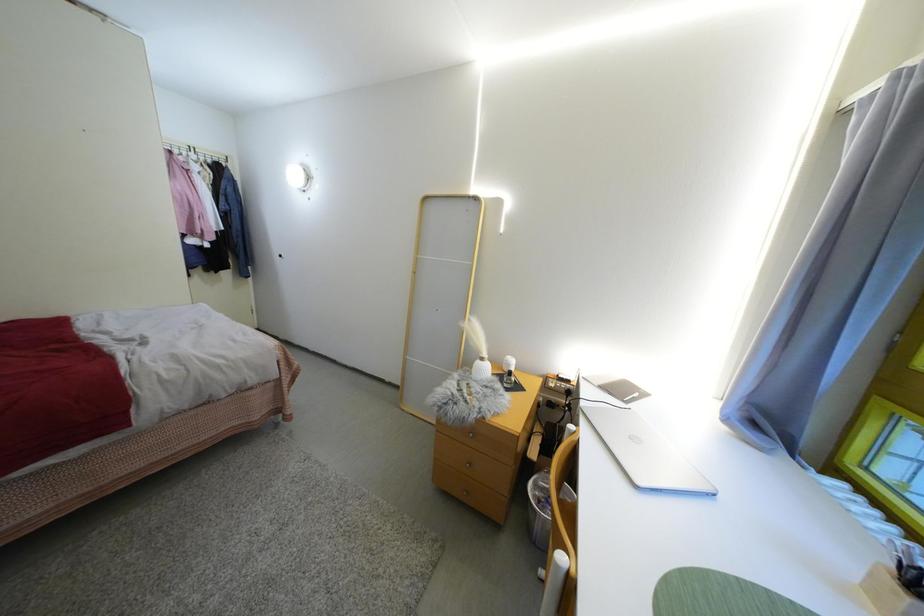
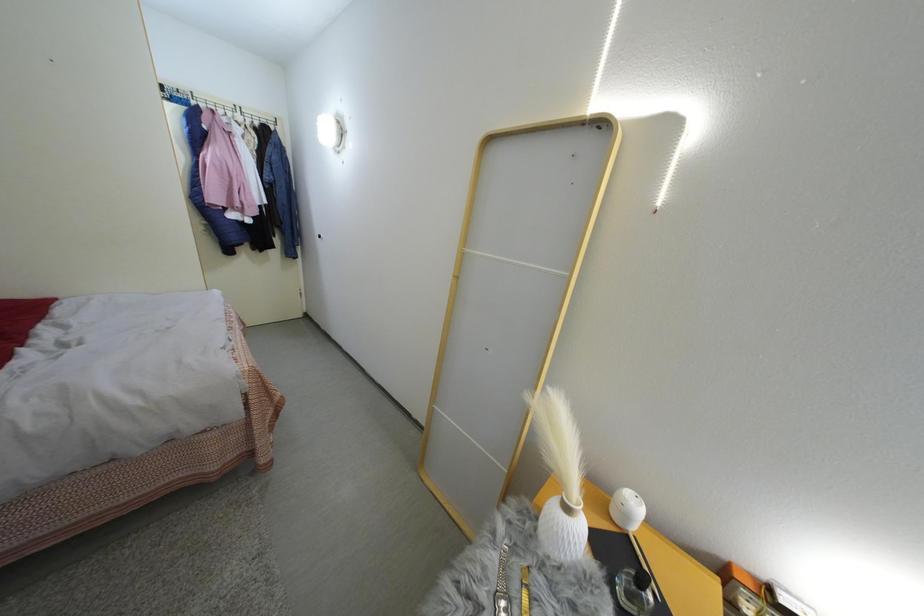
Question: The camera is either moving clockwise (left) or counter-clockwise (right) around the object. The first image is from the beginning of the video and the second image is from the end. Is the camera moving left or right when shooting the video?

Choices:
 (A) Left
 (B) Right

Answer: (B)